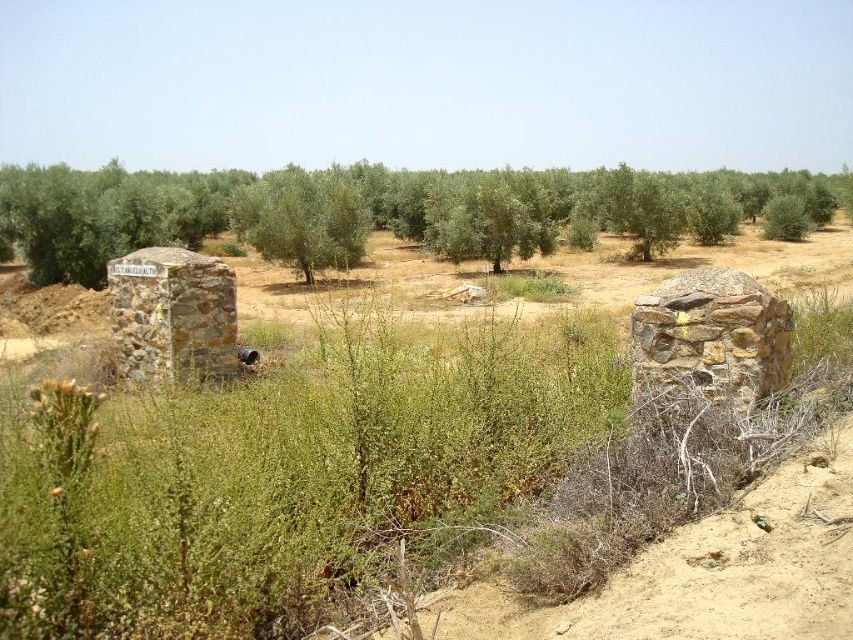
You are a farmer standing in the field of olive trees. You notice a brown rough stone at center and a green leafy tree at center. Which object is narrower in width?

The brown rough stone at center is thinner than the green leafy tree at center, so the brown rough stone at center is narrower in width.